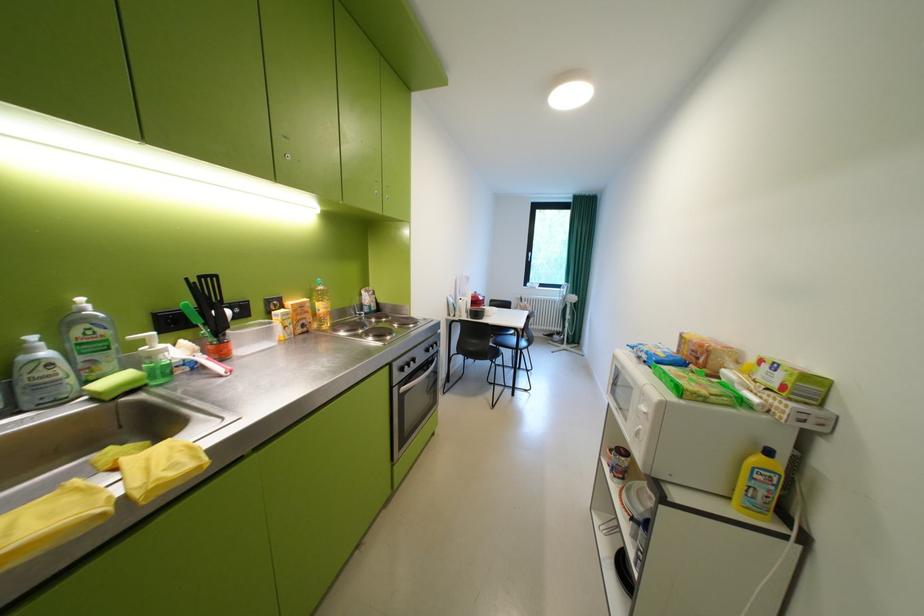
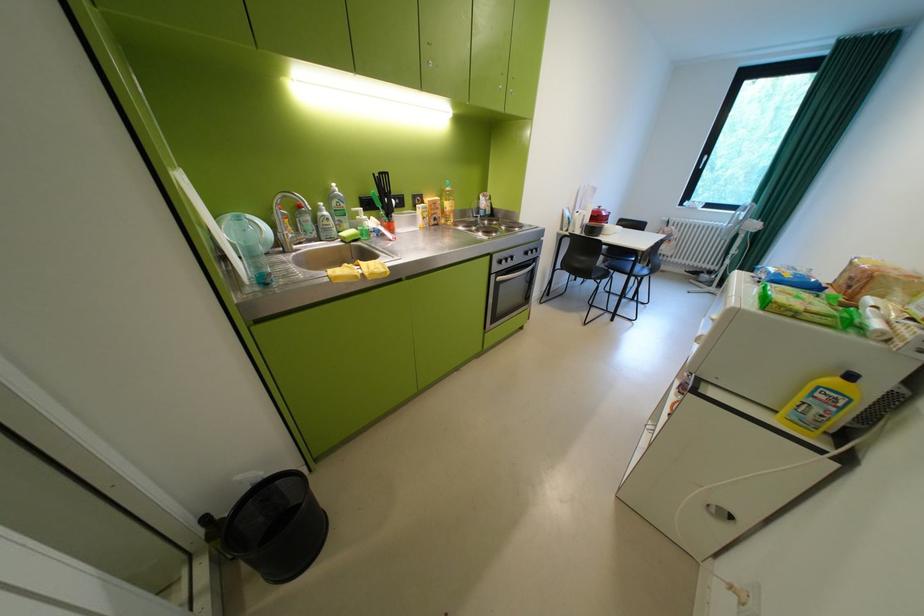
In the second image, find the point that corresponds to (x=397, y=368) in the first image.

(499, 257)